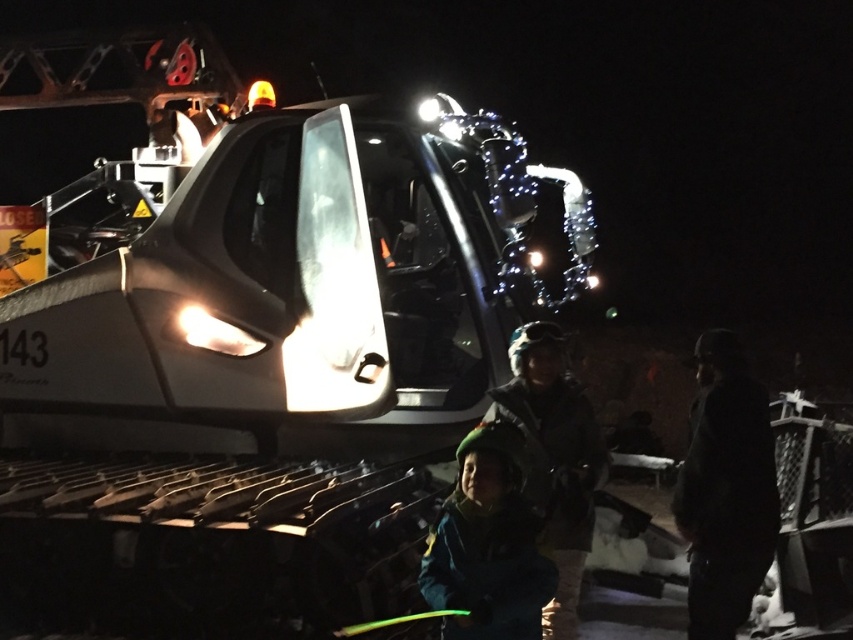
Question: Estimate the real-world distances between objects in this image. Which object is closer to the dark woolen hat at center?

Choices:
 (A) green fuzzy hat at lower center
 (B) metallic silver tank at center
 (C) dark green jacket at center

Answer: (C)

Question: Among these objects, which one is nearest to the camera?

Choices:
 (A) green fuzzy hat at lower center
 (B) dark green jacket at center
 (C) dark woolen hat at center

Answer: (A)

Question: Considering the real-world distances, which object is farthest from the green fuzzy hat at lower center?

Choices:
 (A) dark green jacket at center
 (B) metallic silver tank at center
 (C) dark woolen hat at center

Answer: (B)

Question: Is metallic silver tank at center above green fuzzy hat at lower center?

Choices:
 (A) no
 (B) yes

Answer: (B)

Question: Is metallic silver tank at center closer to the viewer compared to dark green jacket at center?

Choices:
 (A) no
 (B) yes

Answer: (A)

Question: Can you confirm if dark woolen hat at center is positioned above green fuzzy hat at lower center?

Choices:
 (A) no
 (B) yes

Answer: (B)